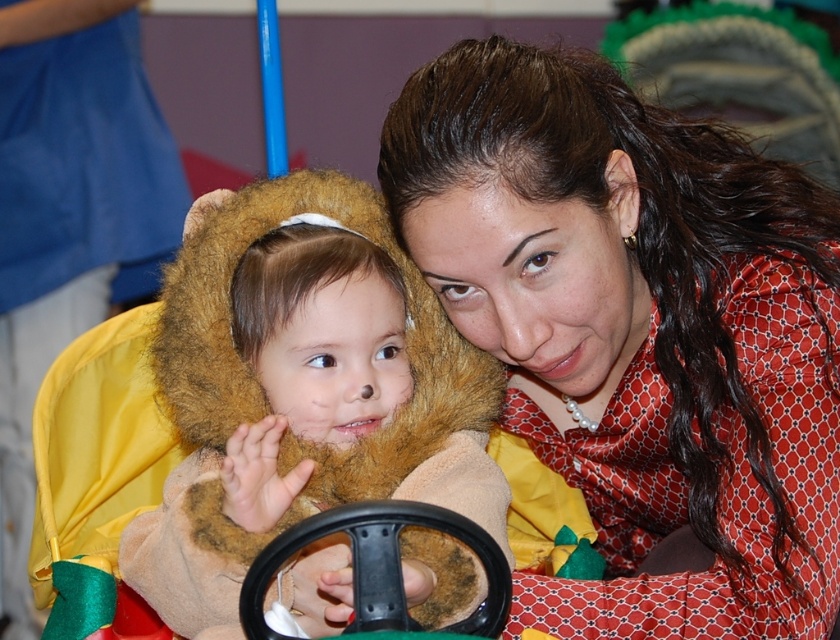
Question: Where is smooth red blouse at upper right located in relation to fuzzy brown bear at center in the image?

Choices:
 (A) below
 (B) above

Answer: (B)

Question: Among these points, which one is farthest from the camera?

Choices:
 (A) (594, 467)
 (B) (302, 241)

Answer: (A)

Question: Which object is closer to the camera taking this photo?

Choices:
 (A) smooth red blouse at upper right
 (B) fuzzy brown bear at center

Answer: (B)

Question: Where is smooth red blouse at upper right located in relation to fuzzy brown bear at center in the image?

Choices:
 (A) right
 (B) left

Answer: (A)

Question: Which object is farther from the camera taking this photo?

Choices:
 (A) smooth red blouse at upper right
 (B) fuzzy brown bear at center

Answer: (A)

Question: Can you confirm if smooth red blouse at upper right is positioned below fuzzy brown bear at center?

Choices:
 (A) yes
 (B) no

Answer: (B)